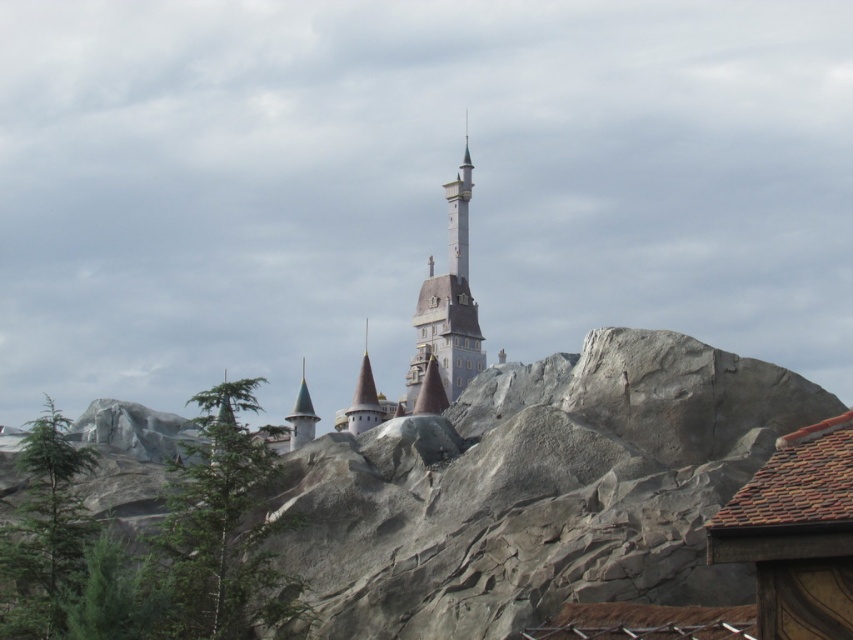
Question: Which point is farther to the camera?

Choices:
 (A) green textured tree at center-left
 (B) white stone tower at center
 (C) green glazed tower at center

Answer: (C)

Question: Does white stone tower at center have a smaller size compared to white glossy spire at upper center?

Choices:
 (A) no
 (B) yes

Answer: (A)

Question: Can you confirm if white glossy spire at upper center is positioned above green glazed tower at center?

Choices:
 (A) no
 (B) yes

Answer: (B)

Question: Which object appears farthest from the camera in this image?

Choices:
 (A) white stone tower at center
 (B) white glossy spire at upper center
 (C) green glazed tower at center
 (D) green matte tree at lower left

Answer: (B)

Question: Among these points, which one is farthest from the camera?

Choices:
 (A) (447, 304)
 (B) (213, 572)
 (C) (302, 371)
 (D) (12, 618)

Answer: (C)

Question: Is green matte tree at lower left thinner than gold spire at center?

Choices:
 (A) no
 (B) yes

Answer: (A)